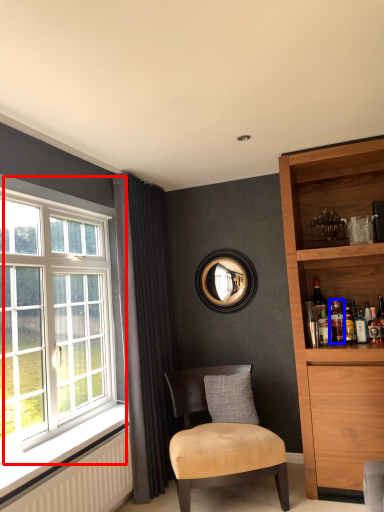
Question: Which of the following is the closest to the observer, window (highlighted by a red box) or beverage (highlighted by a blue box)?

Choices:
 (A) window
 (B) beverage

Answer: (A)